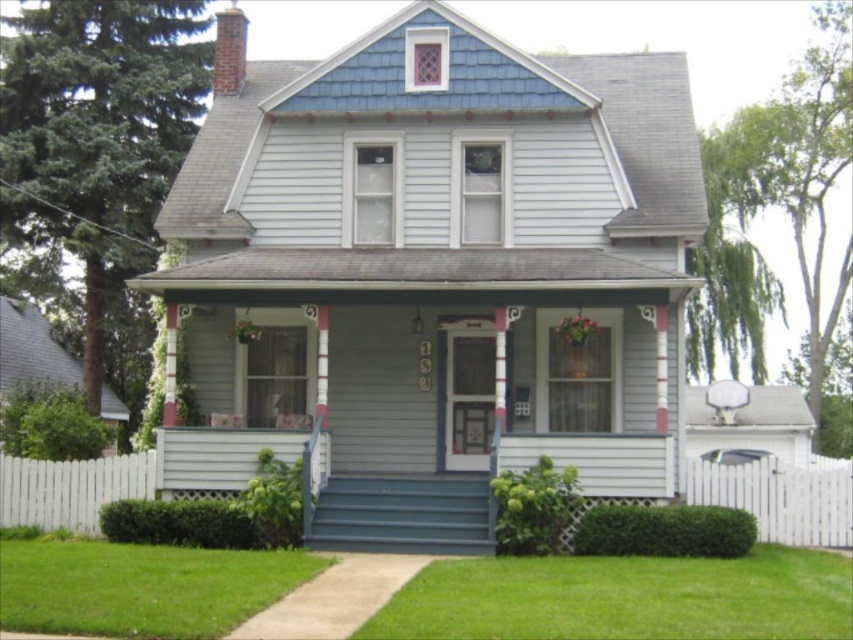
Consider the image. Between green grass at lower center and green grass at lower left, which one has less height?

Standing shorter between the two is green grass at lower center.

Does point (838, 609) lie in front of point (146, 580)?

Yes.

Where is `green grass at lower center`? The width and height of the screenshot is (853, 640). green grass at lower center is located at coordinates (624, 596).